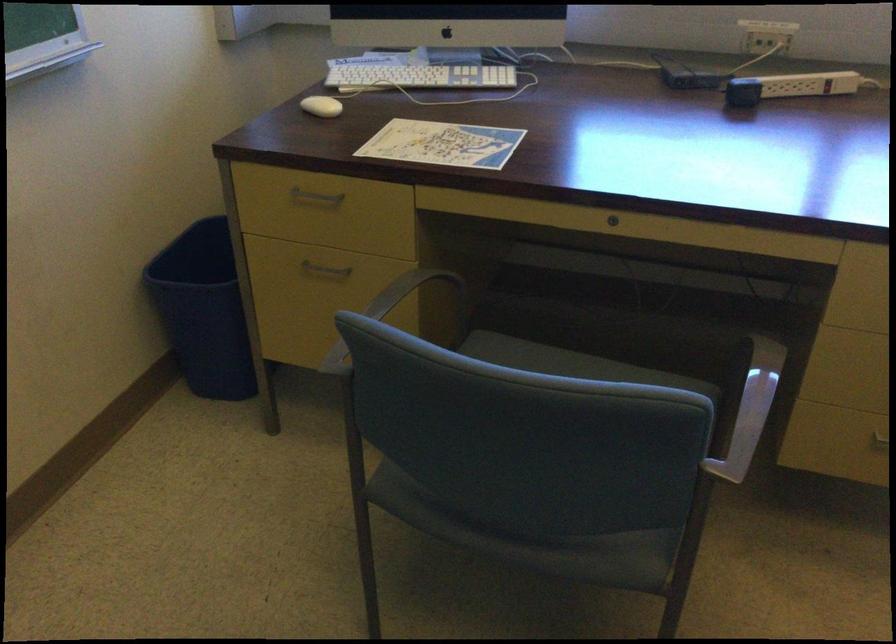
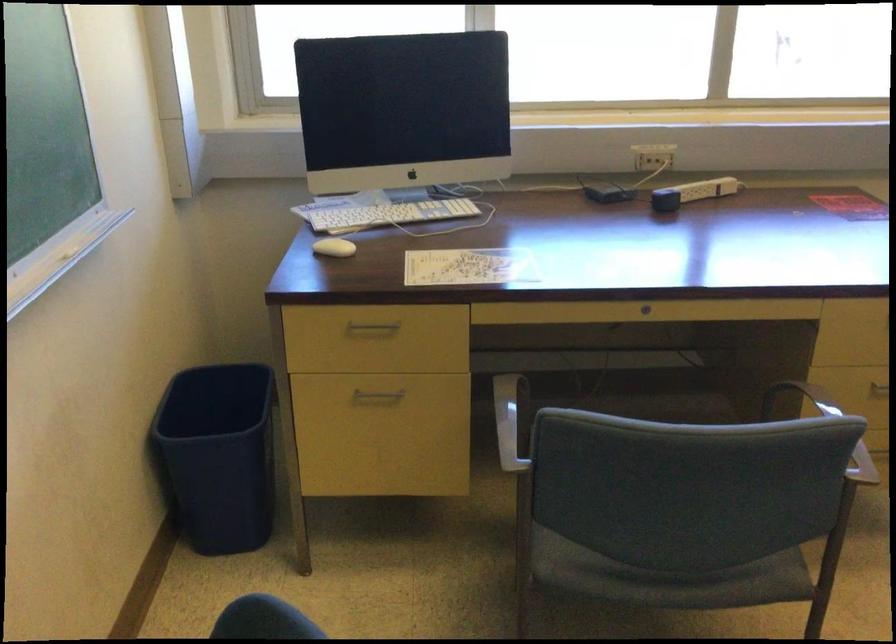
Where in the second image is the point corresponding to [325,272] from the first image?

(376, 395)